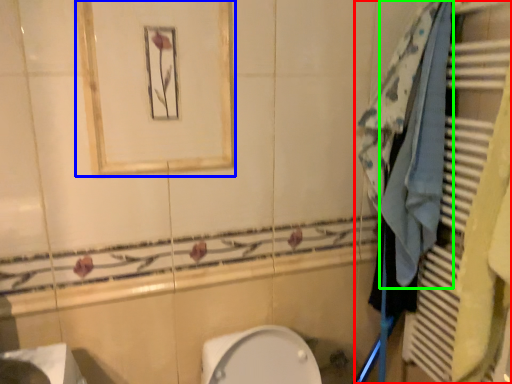
Question: Which object is positioned farthest from closet (highlighted by a red box)? Select from medicine cabinet (highlighted by a blue box) and bath towel (highlighted by a green box).

Choices:
 (A) medicine cabinet
 (B) bath towel

Answer: (A)